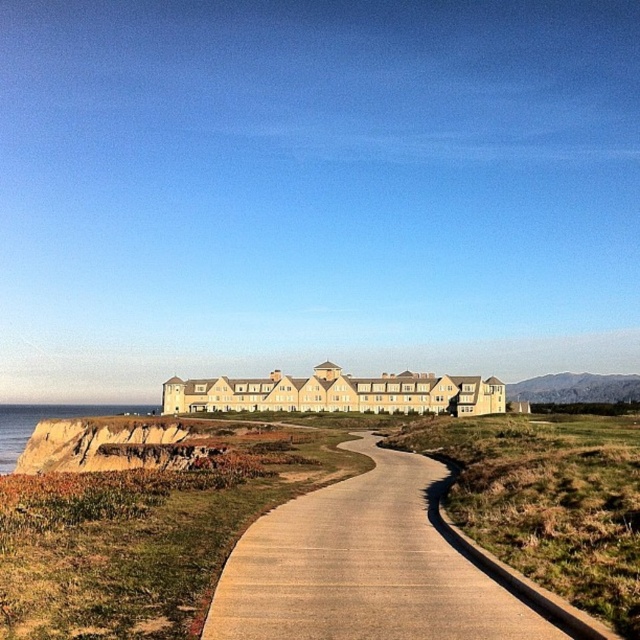
From the picture: You are a tourist standing at the entrance of the curved concrete pathway. You want to take a photo of the brown rocky cliff at left while also including the concrete at center in the frame. Which direction should you face to capture both in your shot?

You should face to the right of the brown rocky cliff at left to include the concrete at center in the frame since the concrete at center is positioned to the right of the brown rocky cliff at left.

You are standing at the cliff overlooking the ocean and want to walk to the point marked by point (396, 632) and point (113, 460). Which point should you head towards first if you want to reach the one closer to the building?

Point (396, 632) is in front of point (113, 460), so you should head towards point (396, 632) first as it is closer to the building.

Based on the photo, you are a landscape architect designing a new garden. You have to place a large statue that requires a flat, stable surface. Based on the scene, which object between the concrete at center and the brown rocky cliff at left would be more suitable for placing the statue?

The concrete at center is more suitable for placing the statue because it has a smaller size compared to the brown rocky cliff at left, making it a flatter and more stable surface.